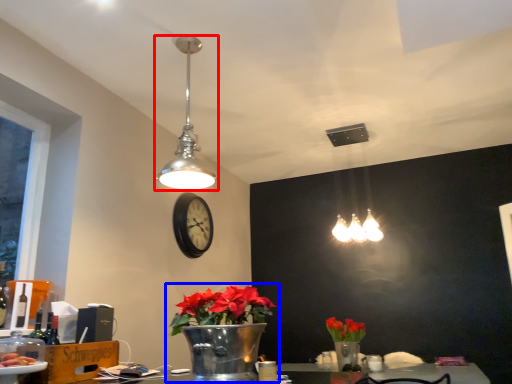
Question: Among these objects, which one is nearest to the camera, lamp (highlighted by a red box) or houseplant (highlighted by a blue box)?

Choices:
 (A) lamp
 (B) houseplant

Answer: (B)